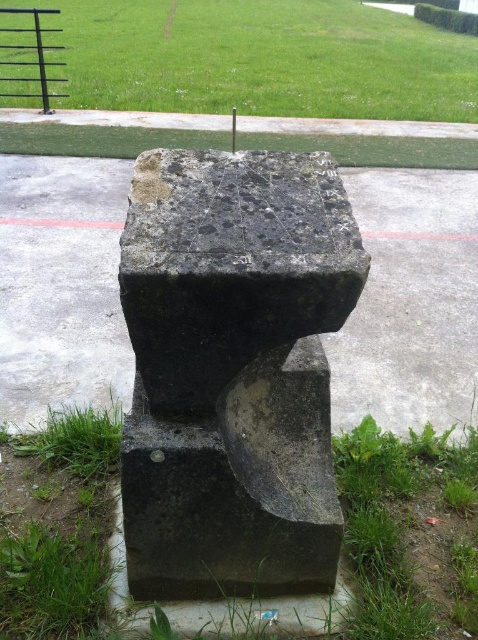
Based on the photo, between dark gray concrete at center and green grass at lower left, which one has less height?

green grass at lower left is shorter.

Does dark gray concrete at center appear on the right side of green grass at lower left?

Correct, you'll find dark gray concrete at center to the right of green grass at lower left.

Which is in front, point (455, 310) or point (355, 627)?

Point (355, 627) is in front.

Where is `dark gray concrete at center`? The image size is (478, 640). dark gray concrete at center is located at coordinates (411, 301).

Who is lower down, dark gray stone sculpture at center or green grass at upper center?

dark gray stone sculpture at center is lower down.

Does point (296, 204) come closer to viewer compared to point (88, 77)?

Yes.

What do you see at coordinates (232, 369) in the screenshot? I see `dark gray stone sculpture at center` at bounding box center [232, 369].

Where is `dark gray stone sculpture at center`? The image size is (478, 640). dark gray stone sculpture at center is located at coordinates (232, 369).

Can you confirm if dark gray stone sculpture at center is taller than green grass at lower left?

Correct, dark gray stone sculpture at center is much taller as green grass at lower left.

In the scene shown: Does dark gray stone sculpture at center appear over green grass at lower left?

Yes, dark gray stone sculpture at center is above green grass at lower left.

Which is in front, point (318, 518) or point (86, 528)?

Point (318, 518) is in front.

Where is `dark gray stone sculpture at center`? dark gray stone sculpture at center is located at coordinates (232, 369).